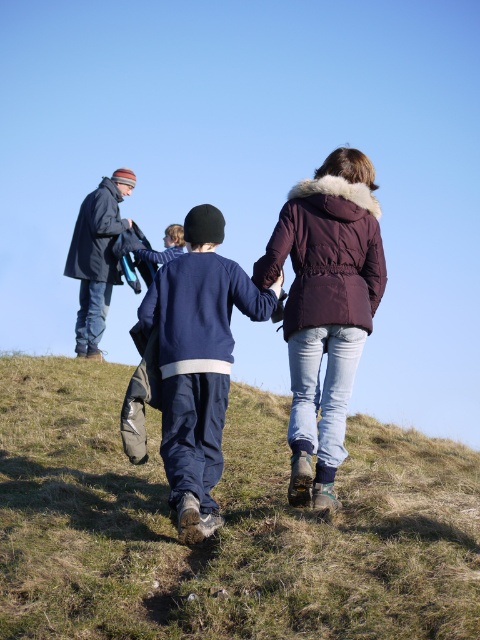
Is green grassy at lower center closer to camera compared to dark blue jacket at left?

Yes.

Image resolution: width=480 pixels, height=640 pixels. Describe the element at coordinates (224, 525) in the screenshot. I see `green grassy at lower center` at that location.

Locate an element on the screen. The image size is (480, 640). green grassy at lower center is located at coordinates (224, 525).

Locate an element on the screen. This screenshot has width=480, height=640. green grassy at lower center is located at coordinates (224, 525).

Does point (48, 468) come in front of point (326, 237)?

No, (48, 468) is behind (326, 237).

Who is more distant from viewer, (87,468) or (200,339)?

Point (87,468)

Locate an element on the screen. green grassy at lower center is located at coordinates (224, 525).

Between dark purple fleece jacket at center and maroon synthetic jacket at center, which one has less height?

With less height is maroon synthetic jacket at center.

Is the position of dark purple fleece jacket at center less distant than that of maroon synthetic jacket at center?

Yes, dark purple fleece jacket at center is closer to the viewer.

Between point (317, 490) and point (297, 294), which one is positioned in front?

Point (317, 490)

Locate an element on the screen. dark purple fleece jacket at center is located at coordinates (325, 308).